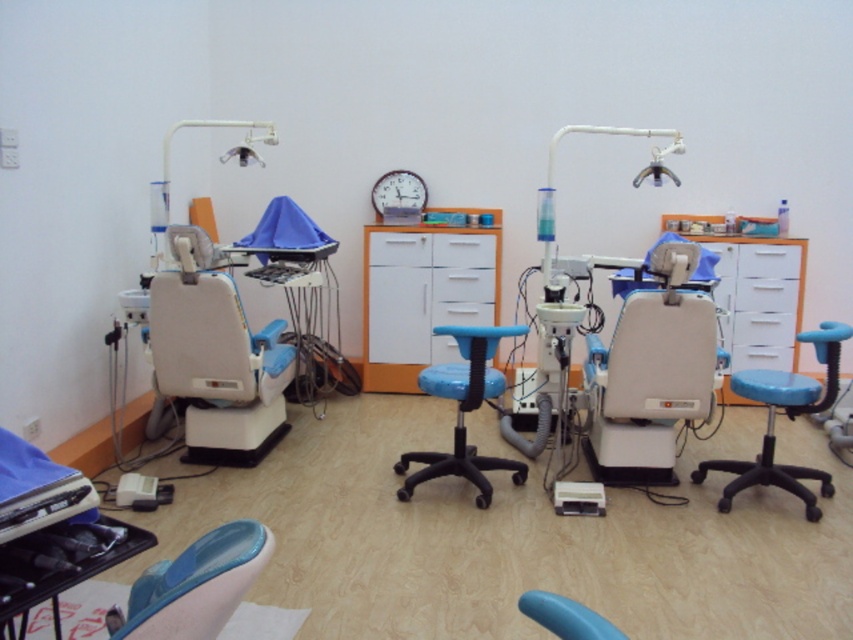
Can you confirm if blue fabric stool at center is positioned above blue plastic stool at center?

Yes.

Who is taller, blue fabric stool at center or blue plastic stool at center?

blue fabric stool at center

Does point (776, 378) lie in front of point (445, 330)?

No, it is behind (445, 330).

The image size is (853, 640). I want to click on blue fabric stool at center, so click(788, 417).

Looking at this image, does white glossy cabinet at center appear under blue fabric stool at center?

Incorrect, white glossy cabinet at center is not positioned below blue fabric stool at center.

In the scene shown: Can you confirm if white glossy cabinet at center is bigger than blue fabric stool at center?

No.

Image resolution: width=853 pixels, height=640 pixels. What are the coordinates of `white glossy cabinet at center` in the screenshot? It's located at (421, 296).

I want to click on white glossy cabinet at center, so click(x=421, y=296).

Which is more to the right, blue plastic chair at lower center or wooden clock at center?

blue plastic chair at lower center

Does blue plastic chair at lower center lie behind wooden clock at center?

No.

Where is `blue plastic chair at lower center`? This screenshot has height=640, width=853. blue plastic chair at lower center is located at coordinates (566, 616).

Identify the location of blue plastic chair at lower center. Image resolution: width=853 pixels, height=640 pixels. (566, 616).